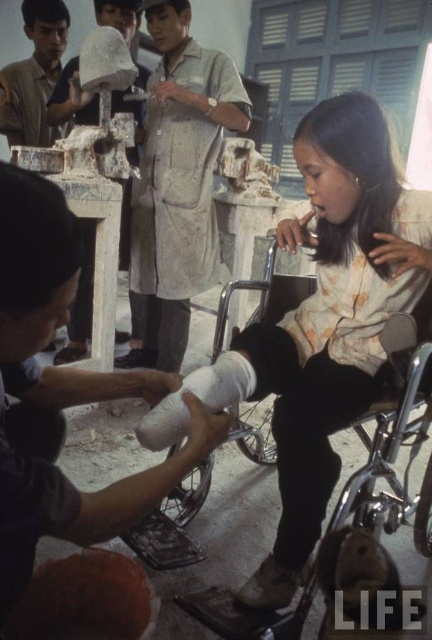
Question: Observing the image, what is the correct spatial positioning of silver metallic wheelchair at lower center in reference to white matte plaster bandage at lower center?

Choices:
 (A) below
 (B) above

Answer: (A)

Question: Is the position of silver metallic wheelchair at lower center less distant than that of white matte plaster bandage at lower center?

Choices:
 (A) yes
 (B) no

Answer: (B)

Question: Which point is farther from the camera taking this photo?

Choices:
 (A) (235, 600)
 (B) (235, 403)

Answer: (B)

Question: Does silver metallic wheelchair at lower center have a lesser width compared to white matte plaster bandage at lower center?

Choices:
 (A) no
 (B) yes

Answer: (A)